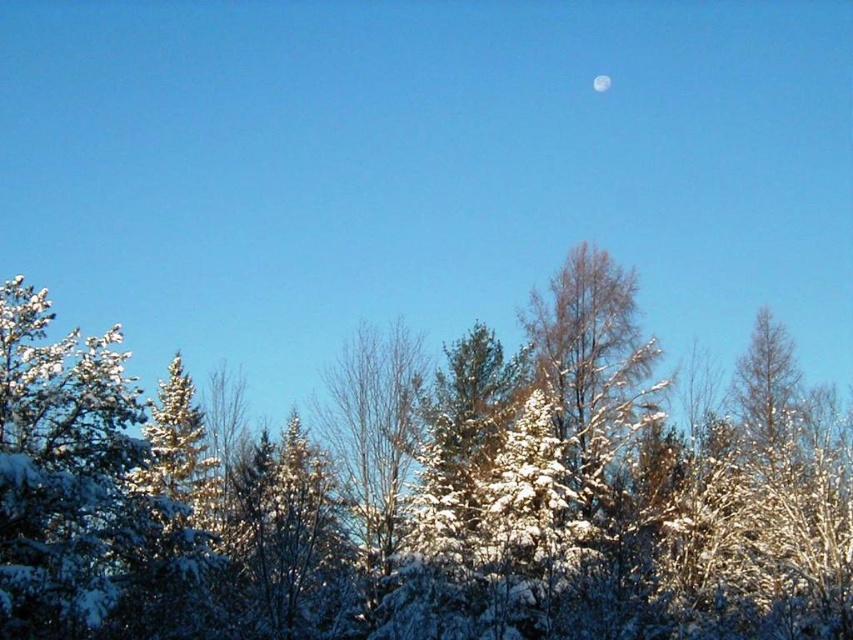
Who is more forward, (334,396) or (599,74)?

Positioned in front is point (334,396).

Does white snow-covered trees at center have a greater height compared to white glossy moon at upper center?

Yes.

Locate an element on the screen. Image resolution: width=853 pixels, height=640 pixels. white snow-covered trees at center is located at coordinates (422, 493).

What are the coordinates of `white snow-covered trees at center` in the screenshot? It's located at (422, 493).